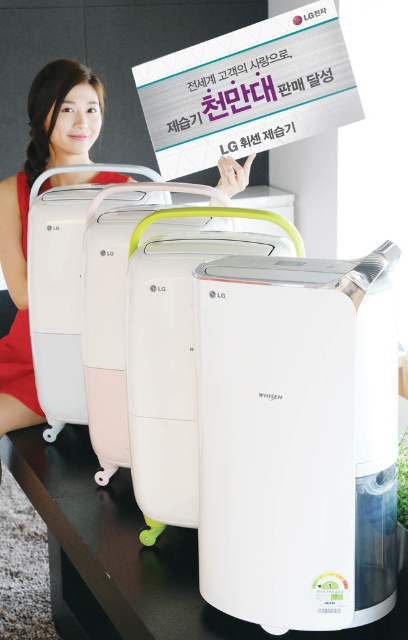
Looking at this image, you are standing in front of the promotional display and need to place a small decorative item on the black glossy table at center. Based on its position, is the table more towards the left or right side of the scene?

The black glossy table at center is located at point coordinates indicating it is positioned towards the right side of the scene.

You are standing in front of the promotional display and want to pick up the matte pink dress at upper left. Can you reach it without moving the black glossy table at center?

The black glossy table at center is closer to the viewer than the matte pink dress at upper left, so you would need to move the table to reach the dress.